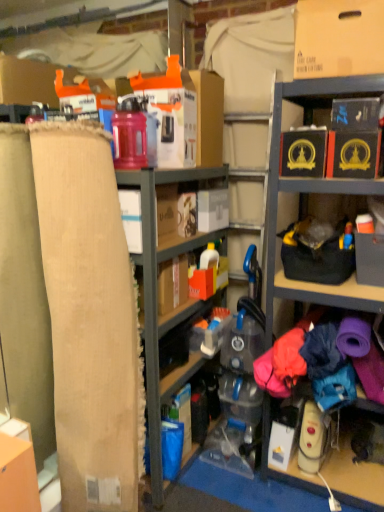
Question: Is burlap cardboard at left to the left of beige fabric at left from the viewer's perspective?

Choices:
 (A) yes
 (B) no

Answer: (A)

Question: From a real-world perspective, is burlap cardboard at left located beneath beige fabric at left?

Choices:
 (A) yes
 (B) no

Answer: (B)

Question: Can we say burlap cardboard at left lies outside beige fabric at left?

Choices:
 (A) yes
 (B) no

Answer: (A)

Question: Is burlap cardboard at left smaller than beige fabric at left?

Choices:
 (A) yes
 (B) no

Answer: (A)

Question: Can you confirm if burlap cardboard at left is taller than beige fabric at left?

Choices:
 (A) yes
 (B) no

Answer: (A)

Question: Would you say burlap cardboard at left is to the left or to the right of white cardboard toaster at center, placed as the third storage box when sorted from right to left, in the picture?

Choices:
 (A) left
 (B) right

Answer: (A)

Question: In terms of width, does burlap cardboard at left look wider or thinner when compared to white cardboard toaster at center, placed as the third storage box when sorted from right to left?

Choices:
 (A) wide
 (B) thin

Answer: (A)

Question: From a real-world perspective, is burlap cardboard at left above or below white cardboard toaster at center, placed as the third storage box when sorted from right to left?

Choices:
 (A) below
 (B) above

Answer: (A)

Question: Relative to white cardboard toaster at center, placed as the third storage box when sorted from right to left, is burlap cardboard at left in front or behind?

Choices:
 (A) behind
 (B) front

Answer: (B)

Question: Is black cardboard box at upper right, the 3th storage box in the left-to-right sequence, to the left or to the right of white cardboard toaster at center, the first storage box viewed from the left, in the image?

Choices:
 (A) left
 (B) right

Answer: (B)

Question: From the image's perspective, is black cardboard box at upper right, acting as the 1th storage box starting from the right, above or below white cardboard toaster at center, placed as the third storage box when sorted from right to left?

Choices:
 (A) below
 (B) above

Answer: (B)

Question: From a real-world perspective, is black cardboard box at upper right, acting as the 1th storage box starting from the right, positioned above or below white cardboard toaster at center, placed as the third storage box when sorted from right to left?

Choices:
 (A) below
 (B) above

Answer: (B)

Question: In terms of height, does black cardboard box at upper right, the 3th storage box in the left-to-right sequence, look taller or shorter compared to white cardboard toaster at center, placed as the third storage box when sorted from right to left?

Choices:
 (A) tall
 (B) short

Answer: (B)

Question: In the image, is black cardboard box at upper right, positioned as the 2th storage box in right-to-left order, on the left side or the right side of black cardboard box at upper right, the 3th storage box in the left-to-right sequence?

Choices:
 (A) left
 (B) right

Answer: (A)

Question: Does point (284, 138) appear closer or farther from the camera than point (359, 132)?

Choices:
 (A) farther
 (B) closer

Answer: (A)